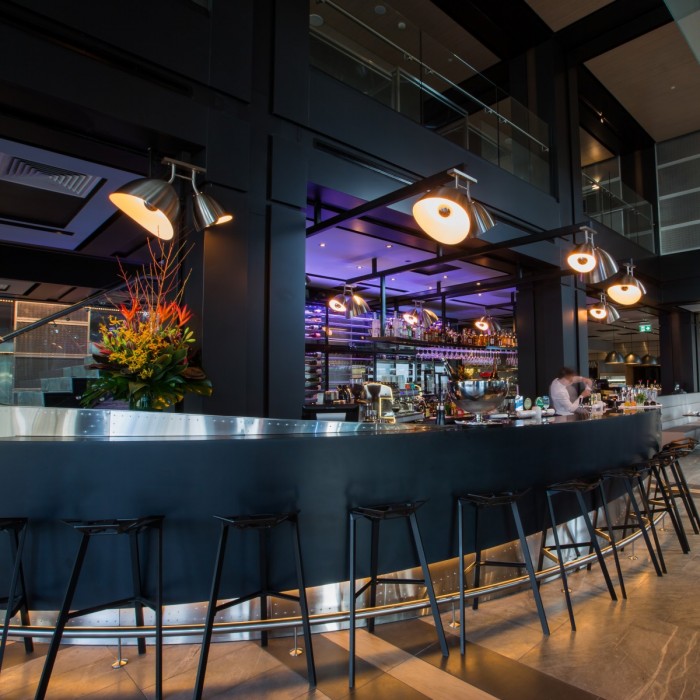
The image size is (700, 700). Find the location of `bar`. bar is located at coordinates (533, 424).